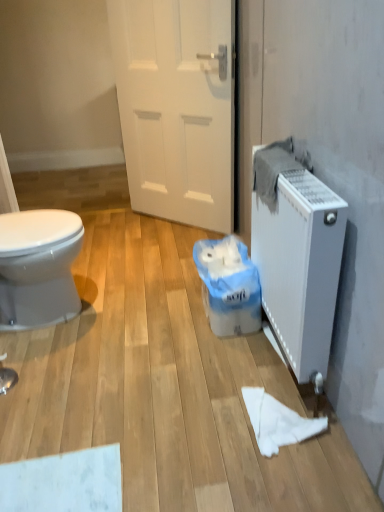
Where is `vacant area that is in front of white paper towel at lower center`? This screenshot has height=512, width=384. vacant area that is in front of white paper towel at lower center is located at coordinates (297, 479).